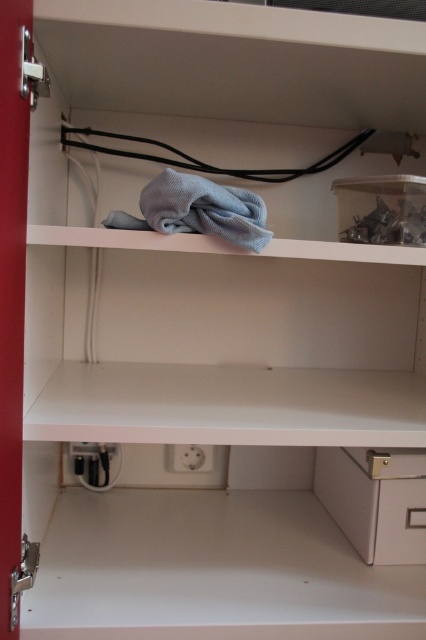
You are moving a small appliance that is 15 cm wide. You want to place it near the white plastic electric outlet at lower center so it can be plugged in. Is there enough space on the white matte drawer at lower right next to the outlet to place the appliance?

The white matte drawer at lower right might be wider than the white plastic electric outlet at lower center, so there is likely enough space to place the 15 cm wide appliance next to the outlet.

You are standing in front of the open white cabinet and need to determine the position of two points marked in the image. Which point is closer to you, point (409, 525) or point (187, 452)?

Point (409, 525) is closer to the camera than point (187, 452), so the point closer to you is point (409, 525).

You are organizing the cabinet and need to place a rectangular box that is 15 cm wide. You have two options for placement on the shelves. Which object, the white matte drawer at lower right or the gray soft cloth at upper center, has enough width to accommodate the box?

The gray soft cloth at upper center has a greater width than the white matte drawer at lower right, so it can accommodate the 15 cm wide box.